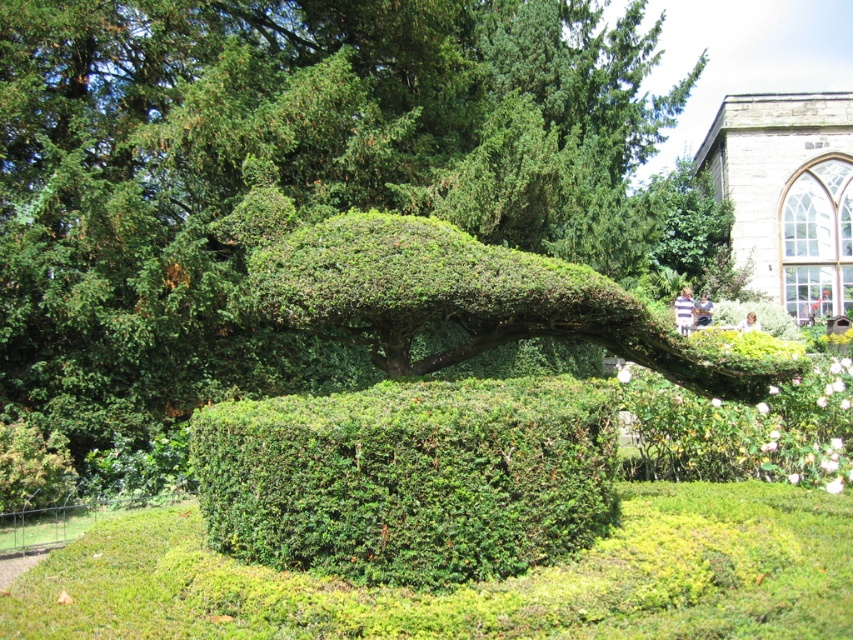
Between green leafy bush at center and green leafy hedge at center, which one has less height?

green leafy hedge at center is shorter.

Does point (114, 173) come farther from viewer compared to point (334, 416)?

Yes, it is behind point (334, 416).

Find the location of a particular element. This screenshot has width=853, height=640. green leafy bush at center is located at coordinates (292, 179).